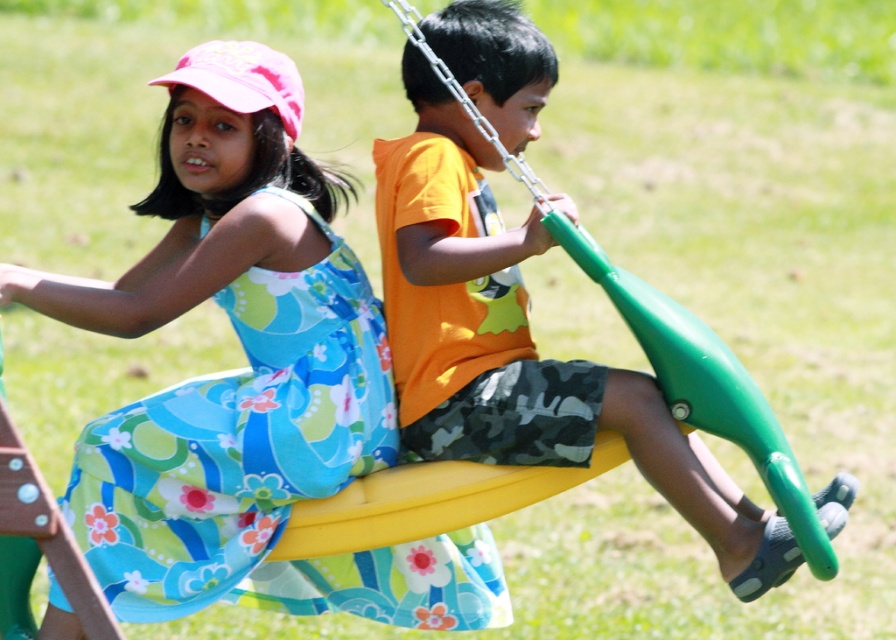
Is the position of floral fabric dress at left more distant than that of green rubber swing at center?

Yes, it is.

This screenshot has width=896, height=640. I want to click on floral fabric dress at left, so [248, 380].